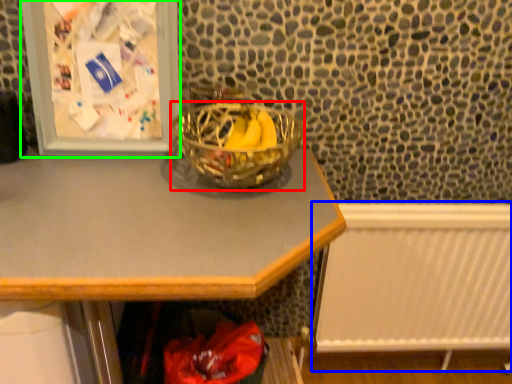
Question: Estimate the real-world distances between objects in this image. Which object is farther from glass bowl (highlighted by a red box), radiator (highlighted by a blue box) or picture frame (highlighted by a green box)?

Choices:
 (A) radiator
 (B) picture frame

Answer: (A)